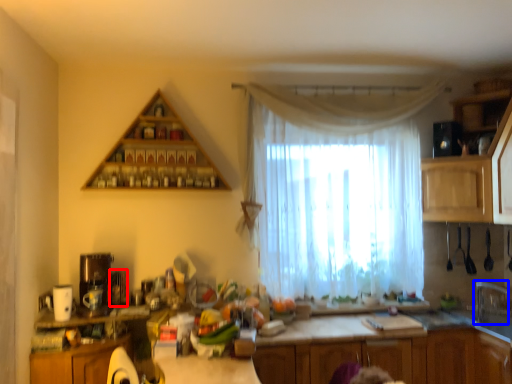
Question: Which object is further to the camera taking this photo, appliance (highlighted by a red box) or faucet (highlighted by a blue box)?

Choices:
 (A) appliance
 (B) faucet

Answer: (A)